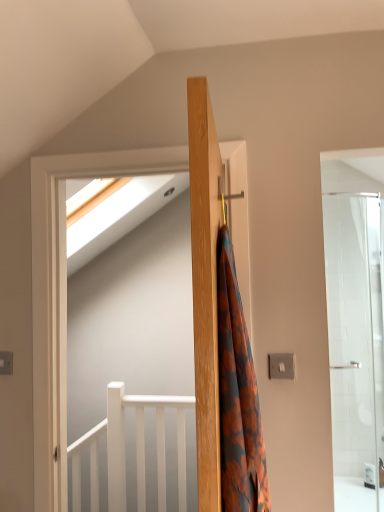
Question: Is white matte balustrade at lower left facing away from white glossy screen door at upper left?

Choices:
 (A) yes
 (B) no

Answer: (B)

Question: Is white matte balustrade at lower left at the left side of white glossy screen door at upper left?

Choices:
 (A) no
 (B) yes

Answer: (B)

Question: Is white matte balustrade at lower left to the right of white glossy screen door at upper left from the viewer's perspective?

Choices:
 (A) yes
 (B) no

Answer: (B)

Question: Is white matte balustrade at lower left wider than white glossy screen door at upper left?

Choices:
 (A) yes
 (B) no

Answer: (A)

Question: From a real-world perspective, is white matte balustrade at lower left beneath white glossy screen door at upper left?

Choices:
 (A) no
 (B) yes

Answer: (B)

Question: Is wooden coat hanger at center in front of or behind orange floral fabric at center in the image?

Choices:
 (A) behind
 (B) front

Answer: (B)

Question: Would you say wooden coat hanger at center is to the left or to the right of orange floral fabric at center in the picture?

Choices:
 (A) left
 (B) right

Answer: (A)

Question: Considering the positions of wooden coat hanger at center and orange floral fabric at center in the image, is wooden coat hanger at center bigger or smaller than orange floral fabric at center?

Choices:
 (A) small
 (B) big

Answer: (B)

Question: Considering the positions of wooden coat hanger at center and orange floral fabric at center in the image, is wooden coat hanger at center taller or shorter than orange floral fabric at center?

Choices:
 (A) short
 (B) tall

Answer: (B)

Question: In the image, is white matte balustrade at lower left positioned in front of or behind white glossy screen door at upper left?

Choices:
 (A) front
 (B) behind

Answer: (B)

Question: Considering the relative positions of white matte balustrade at lower left and white glossy screen door at upper left in the image provided, is white matte balustrade at lower left to the left or to the right of white glossy screen door at upper left?

Choices:
 (A) left
 (B) right

Answer: (A)

Question: Considering the positions of white matte balustrade at lower left and white glossy screen door at upper left in the image, is white matte balustrade at lower left wider or thinner than white glossy screen door at upper left?

Choices:
 (A) wide
 (B) thin

Answer: (A)

Question: From the image's perspective, is white matte balustrade at lower left above or below white glossy screen door at upper left?

Choices:
 (A) below
 (B) above

Answer: (A)

Question: From a real-world perspective, is orange floral fabric at center above or below wooden coat hanger at center?

Choices:
 (A) above
 (B) below

Answer: (B)

Question: Based on their sizes in the image, would you say orange floral fabric at center is bigger or smaller than wooden coat hanger at center?

Choices:
 (A) big
 (B) small

Answer: (B)